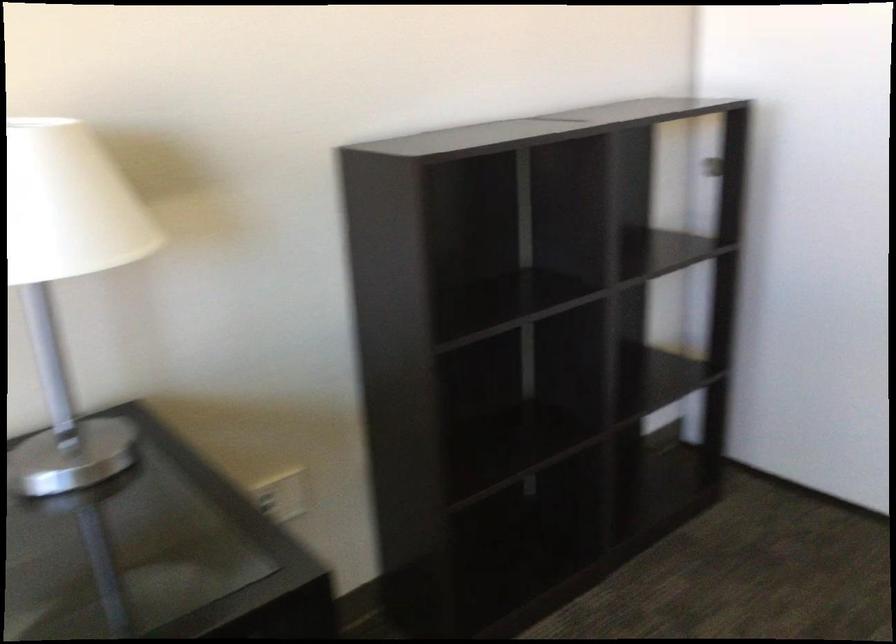
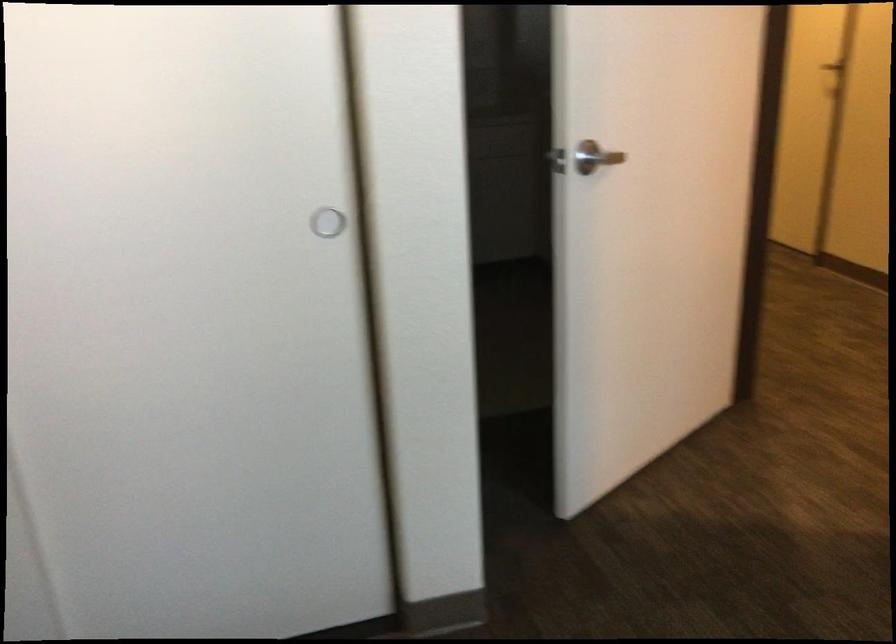
Question: The first image is from the beginning of the video and the second image is from the end. How did the camera likely rotate when shooting the video?

Choices:
 (A) Left
 (B) Right
 (C) Up
 (D) Down

Answer: (B)